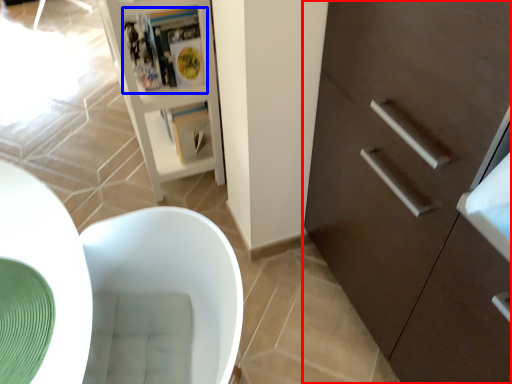
Question: Which object appears closest to the camera in this image, cabinetry (highlighted by a red box) or magazine (highlighted by a blue box)?

Choices:
 (A) cabinetry
 (B) magazine

Answer: (A)